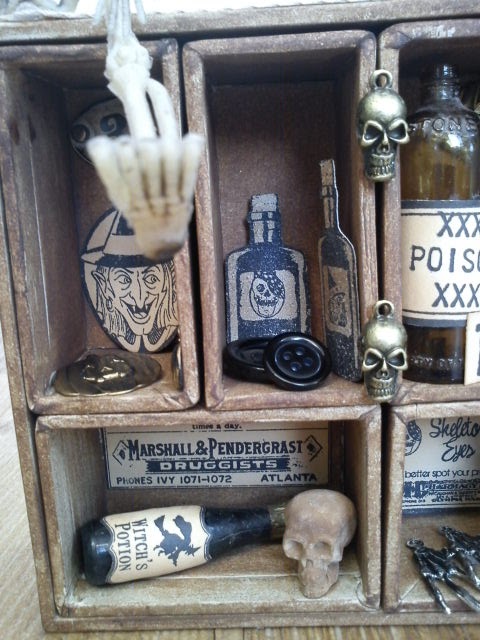
Find the location of a particular element. The width and height of the screenshot is (480, 640). left top edge of cubby hole is located at coordinates (22, 310), (205, 282), (393, 237), (397, 509), (51, 514).